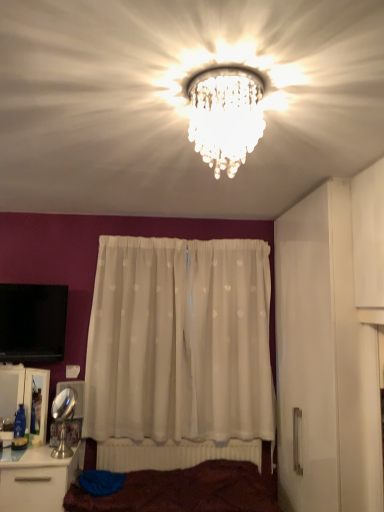
Question: From the image's perspective, is brown fabric bed at lower center under clear crystal chandelier at center?

Choices:
 (A) yes
 (B) no

Answer: (A)

Question: Considering the relative sizes of brown fabric bed at lower center and clear crystal chandelier at center in the image provided, is brown fabric bed at lower center thinner than clear crystal chandelier at center?

Choices:
 (A) no
 (B) yes

Answer: (A)

Question: Is brown fabric bed at lower center beside clear crystal chandelier at center?

Choices:
 (A) yes
 (B) no

Answer: (B)

Question: Can you confirm if brown fabric bed at lower center is taller than clear crystal chandelier at center?

Choices:
 (A) no
 (B) yes

Answer: (A)

Question: Is the position of brown fabric bed at lower center more distant than that of clear crystal chandelier at center?

Choices:
 (A) no
 (B) yes

Answer: (B)

Question: Is brown fabric bed at lower center situated inside white glossy cabinet at lower left or outside?

Choices:
 (A) outside
 (B) inside

Answer: (A)

Question: Considering the positions of brown fabric bed at lower center and white glossy cabinet at lower left in the image, is brown fabric bed at lower center taller or shorter than white glossy cabinet at lower left?

Choices:
 (A) short
 (B) tall

Answer: (A)

Question: From the image's perspective, is brown fabric bed at lower center above or below white glossy cabinet at lower left?

Choices:
 (A) below
 (B) above

Answer: (A)

Question: Based on their sizes in the image, would you say brown fabric bed at lower center is bigger or smaller than white glossy cabinet at lower left?

Choices:
 (A) big
 (B) small

Answer: (A)

Question: From a real-world perspective, relative to white sheer curtain at center, is white glossy cabinet at lower left vertically above or below?

Choices:
 (A) above
 (B) below

Answer: (B)

Question: In the image, is white glossy cabinet at lower left on the left side or the right side of white sheer curtain at center?

Choices:
 (A) right
 (B) left

Answer: (B)

Question: From the image's perspective, is white glossy cabinet at lower left positioned above or below white sheer curtain at center?

Choices:
 (A) below
 (B) above

Answer: (A)

Question: Is white glossy cabinet at lower left bigger or smaller than white sheer curtain at center?

Choices:
 (A) small
 (B) big

Answer: (A)

Question: Looking at the image, does white plastic radiator at lower center seem bigger or smaller compared to clear crystal chandelier at center?

Choices:
 (A) big
 (B) small

Answer: (A)

Question: From a real-world perspective, is white plastic radiator at lower center above or below clear crystal chandelier at center?

Choices:
 (A) above
 (B) below

Answer: (B)